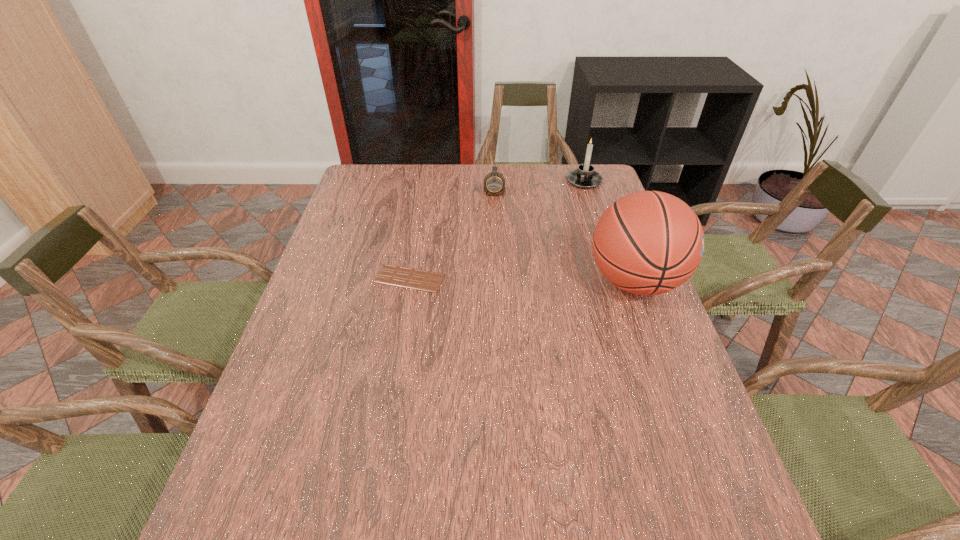
You are a GUI agent. You are given a task and a screenshot of the screen. Output one action in this format:
    pyautogui.click(x=<x>, y=<y>)
    Task: Click on the free space between the shortest object and the third shortest object
    The height and width of the screenshot is (540, 960).
    Given the screenshot: What is the action you would take?
    pyautogui.click(x=496, y=230)

Find the location of a particular element. The height and width of the screenshot is (540, 960). object that is the third closest to the basketball is located at coordinates (428, 281).

Identify the location of the third closest object to the candle holder. (428, 281).

This screenshot has height=540, width=960. I want to click on vacant position in the image that satisfies the following two spatial constraints: 1. on the front side of the chocolate bar; 2. on the logo side of the basketball, so click(x=409, y=281).

Where is `vacant space that satisfies the following two spatial constraints: 1. on the front side of the tallest object; 2. on the logo side of the shortest object`? This screenshot has height=540, width=960. vacant space that satisfies the following two spatial constraints: 1. on the front side of the tallest object; 2. on the logo side of the shortest object is located at coordinates (409, 281).

Locate an element on the screen. The image size is (960, 540). vacant area that satisfies the following two spatial constraints: 1. on the front side of the tallest object; 2. on the logo side of the shortest object is located at coordinates (409, 281).